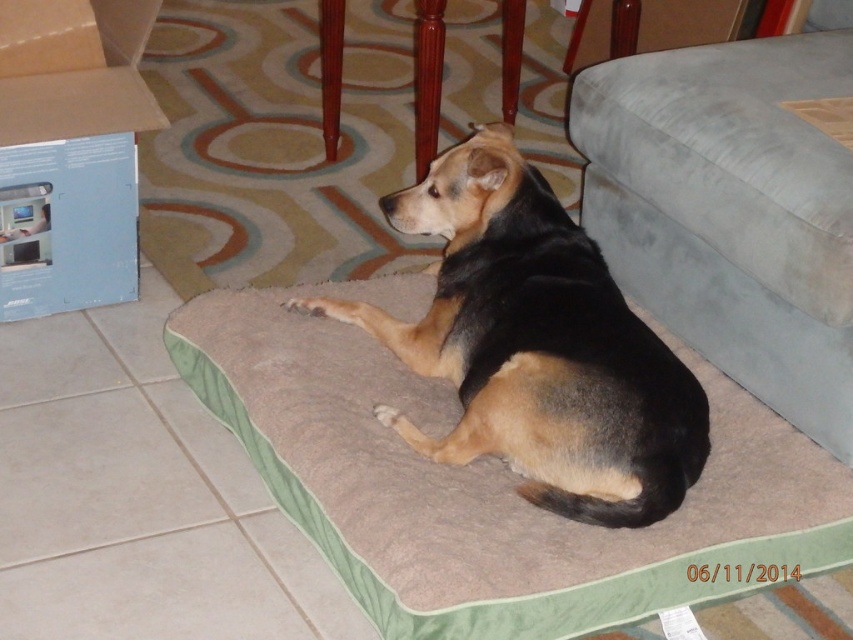
Is beige soft dog bed at center smaller than brown fur dog at center?

Actually, beige soft dog bed at center might be larger than brown fur dog at center.

Is point (399, 468) positioned before point (310, 307)?

Yes, it is in front of point (310, 307).

Is point (425, 611) positioned in front of point (532, 493)?

Yes.

Locate an element on the screen. Image resolution: width=853 pixels, height=640 pixels. beige soft dog bed at center is located at coordinates (486, 483).

Is velvet blue couch at right to the left of brown fur dog at center from the viewer's perspective?

No, velvet blue couch at right is not to the left of brown fur dog at center.

Does point (838, 72) lie in front of point (567, 221)?

No, (838, 72) is behind (567, 221).

Who is more distant from viewer, (x=648, y=134) or (x=611, y=513)?

Point (x=648, y=134)

Locate an element on the screen. velvet blue couch at right is located at coordinates pyautogui.click(x=730, y=211).

Who is shorter, beige soft dog bed at center or velvet blue couch at right?

With less height is beige soft dog bed at center.

Is point (308, 348) in front of point (672, 138)?

No, (308, 348) is further to viewer.

Locate an element on the screen. The height and width of the screenshot is (640, 853). beige soft dog bed at center is located at coordinates (486, 483).